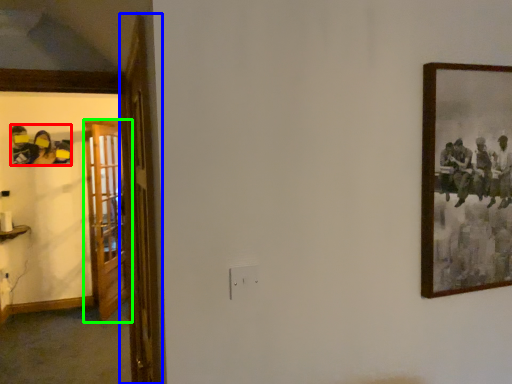
Question: Estimate the real-world distances between objects in this image. Which object is closer to art (highlighted by a red box), door (highlighted by a blue box) or door (highlighted by a green box)?

Choices:
 (A) door
 (B) door

Answer: (B)